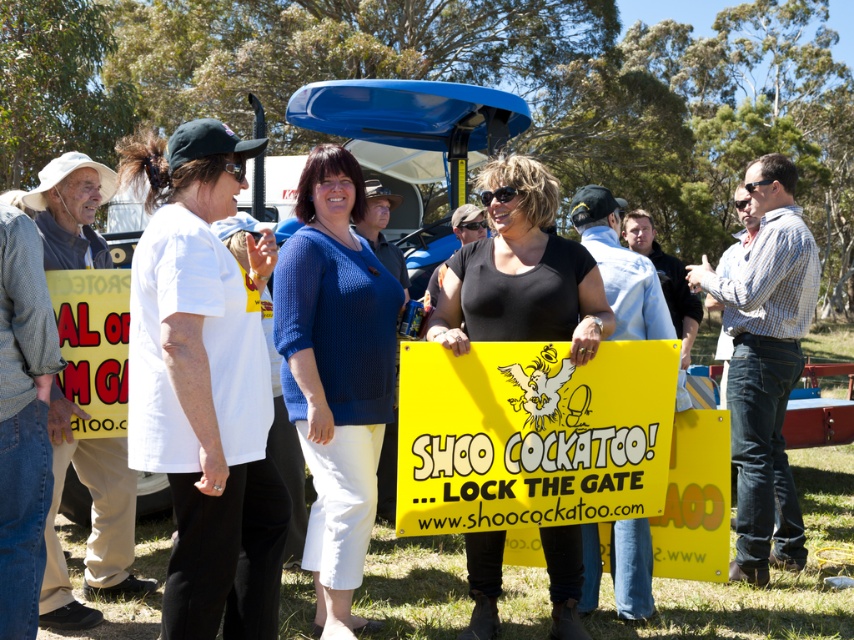
Can you confirm if black matte shirt at center is positioned below yellow paper sign at center?

Actually, black matte shirt at center is above yellow paper sign at center.

Does black matte shirt at center have a smaller size compared to yellow paper sign at center?

No.

Image resolution: width=854 pixels, height=640 pixels. What do you see at coordinates (521, 273) in the screenshot?
I see `black matte shirt at center` at bounding box center [521, 273].

Identify the location of black matte shirt at center. This screenshot has height=640, width=854. (521, 273).

From the picture: Can you confirm if white fabric shirt at left is smaller than blue knitted sweater at center?

Incorrect, white fabric shirt at left is not smaller in size than blue knitted sweater at center.

Which of these two, white fabric shirt at left or blue knitted sweater at center, stands taller?

blue knitted sweater at center is taller.

Which is in front, point (139, 432) or point (340, 376)?

Point (139, 432) is more forward.

Locate an element on the screen. This screenshot has width=854, height=640. white fabric shirt at left is located at coordinates (205, 385).

Can you confirm if yellow plastic sign at center is positioned below blue knitted sweater at center?

Indeed, yellow plastic sign at center is positioned under blue knitted sweater at center.

Does yellow plastic sign at center have a lesser height compared to blue knitted sweater at center?

Correct, yellow plastic sign at center is not as tall as blue knitted sweater at center.

Locate an element on the screen. The image size is (854, 640). yellow plastic sign at center is located at coordinates (531, 435).